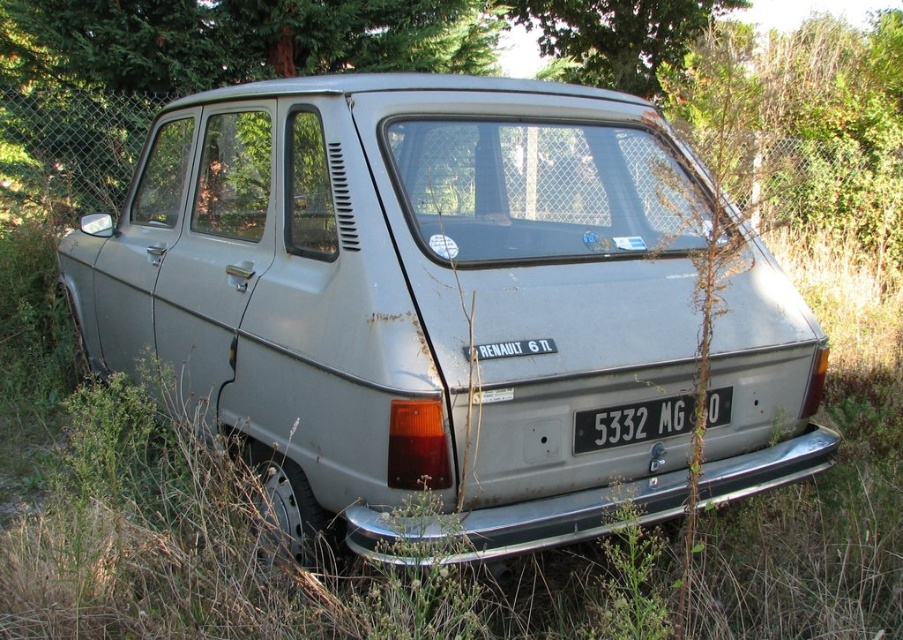
This screenshot has width=903, height=640. What do you see at coordinates (412, 298) in the screenshot?
I see `matte silver car at center` at bounding box center [412, 298].

Is point (388, 490) positioned in front of point (603, 412)?

Yes, point (388, 490) is closer to viewer.

You are a GUI agent. You are given a task and a screenshot of the screen. Output one action in this format:
    pyautogui.click(x=<x>, y=<y>)
    Task: Click on the matte silver car at center
    
    Given the screenshot: What is the action you would take?
    coord(412,298)